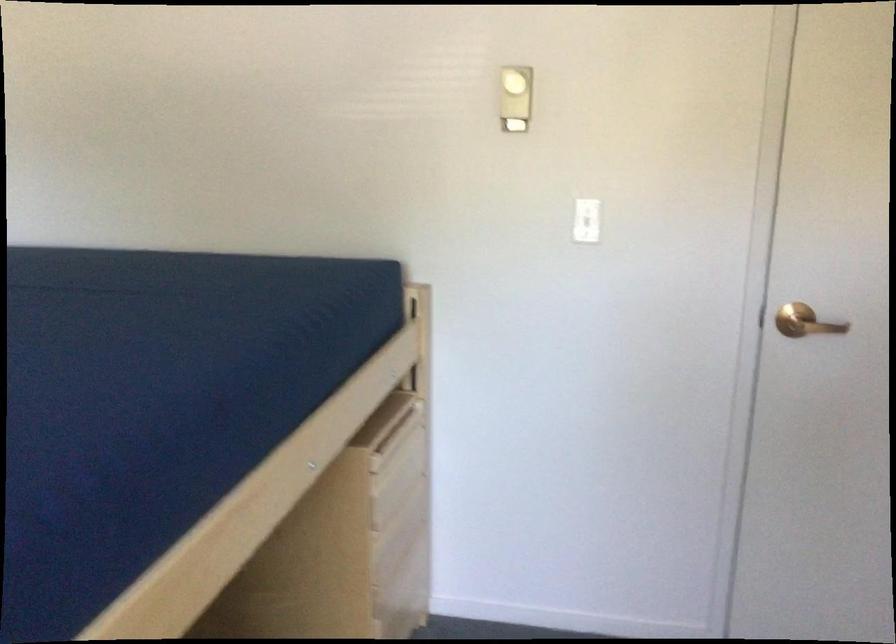
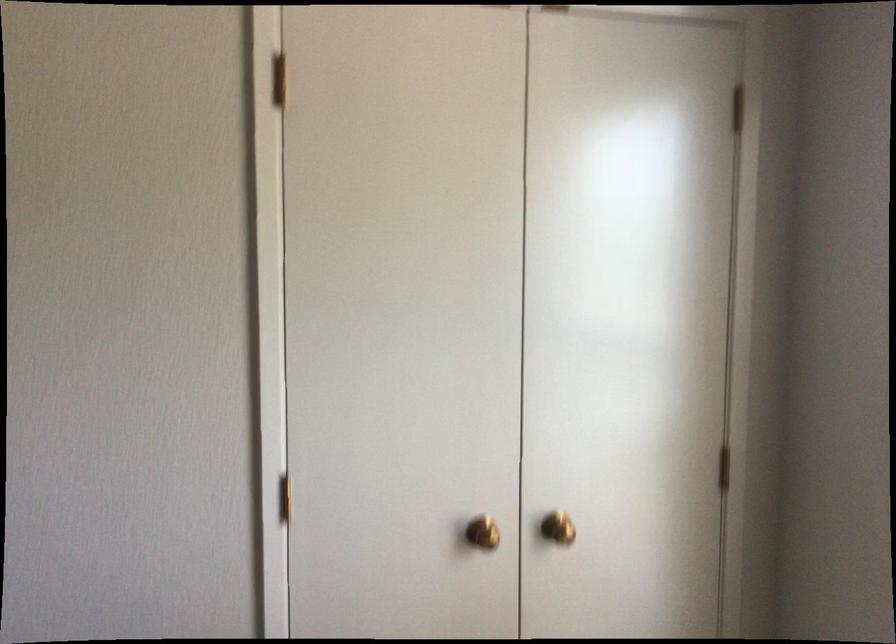
Question: The images are taken continuously from a first-person perspective. In which direction is your viewpoint rotating?

Choices:
 (A) Left
 (B) Right
 (C) Up
 (D) Down

Answer: (B)